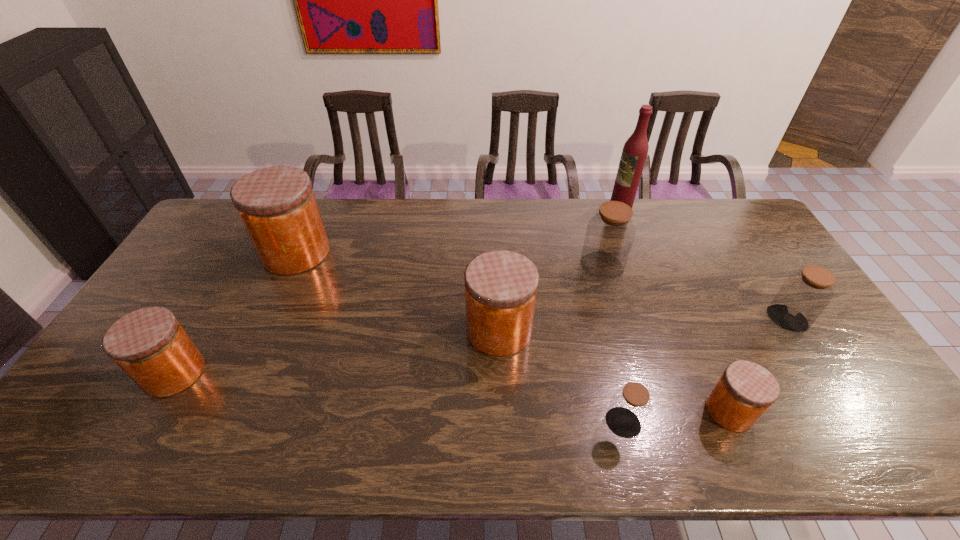
I want to click on the second jar from right to left, so click(745, 391).

What are the coordinates of `the rightmost orange jar` in the screenshot? It's located at (745, 391).

Find the location of a particular element. The height and width of the screenshot is (540, 960). the nearest brown jar is located at coordinates (630, 406).

Locate an element on the screen. Image resolution: width=960 pixels, height=540 pixels. free space located 0.070m on the label of the liquor is located at coordinates (589, 212).

At what (x,y) coordinates should I click in order to perform the action: click on vacant space located 0.070m on the label of the liquor. Please return your answer as a coordinate pair (x, y). The height and width of the screenshot is (540, 960). Looking at the image, I should click on (589, 212).

Where is `blank space located on the label of the liquor`? blank space located on the label of the liquor is located at coordinates (536, 212).

Image resolution: width=960 pixels, height=540 pixels. What are the coordinates of `blank space located 0.120m on the front of the tallest jar` in the screenshot? It's located at [x=274, y=305].

The image size is (960, 540). Identify the location of free location located on the left of the farthest brown jar. (562, 266).

Where is `free space located on the left of the sixth object from right to left`? free space located on the left of the sixth object from right to left is located at coordinates (347, 330).

Identify the location of free region located 0.260m on the left of the rightmost brown jar. (678, 319).